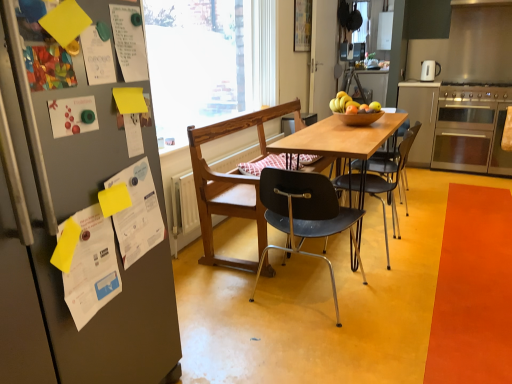
At what (x,y) coordinates should I click in order to perform the action: click on vacant area that lies to the right of wooden chair at center, the second chair when ordered from front to back. Please return your answer as a coordinate pair (x, y). The width and height of the screenshot is (512, 384). Looking at the image, I should click on (452, 216).